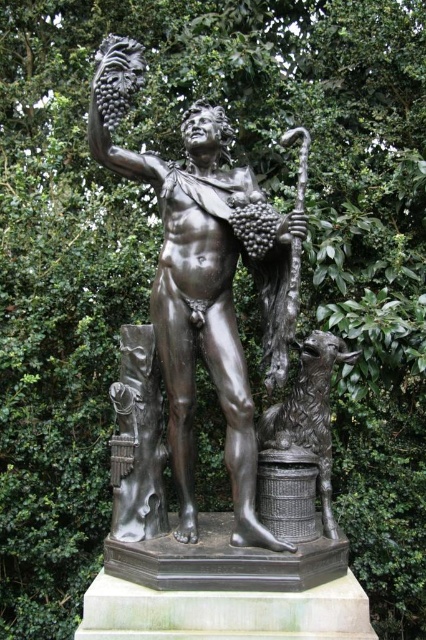
You are an art restorer examining the statue. You notice two points on the statue that need restoration. The first point is at coordinate point (x=104, y=90) and the second is at point (x=285, y=515). Which point is closer to you?

Point (x=104, y=90) is closer to the viewer than point (x=285, y=515).

You are an art curator planning to display the bronze statue at center and the shiny bronze basket at lower center in a gallery. Given their sizes, which object should be placed on a higher pedestal to ensure both are visible to visitors?

The bronze statue at center is larger than the shiny bronze basket at lower center, so placing it on a higher pedestal would ensure both are visible to visitors.

You are a visitor at an art gallery and want to take a photo of the bronze statue at center without the shiny bronze basket at lower center appearing in the frame. How should you adjust your camera angle?

The bronze statue at center is positioned over the shiny bronze basket at lower center. To avoid capturing the basket in your photo, you can angle your camera upward to focus solely on the statue while obscuring the basket beneath it.